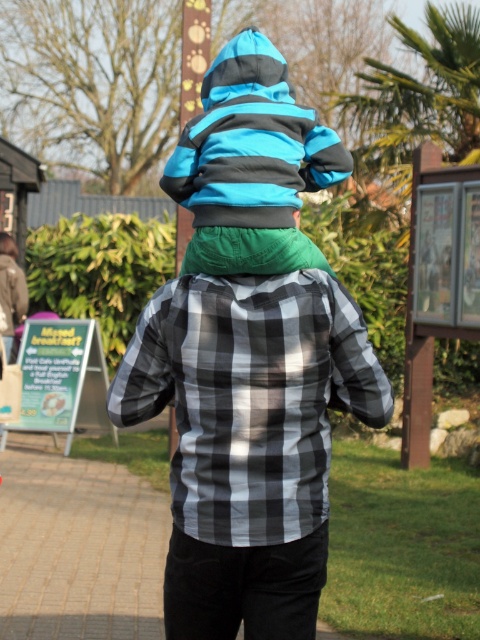
This screenshot has width=480, height=640. What do you see at coordinates (251, 397) in the screenshot? I see `checkered fabric shirt at center` at bounding box center [251, 397].

Is checkered fabric shirt at center to the right of blue striped jacket at center from the viewer's perspective?

No, checkered fabric shirt at center is not to the right of blue striped jacket at center.

What do you see at coordinates (251, 397) in the screenshot? This screenshot has height=640, width=480. I see `checkered fabric shirt at center` at bounding box center [251, 397].

The width and height of the screenshot is (480, 640). Find the location of `checkered fabric shirt at center`. checkered fabric shirt at center is located at coordinates (251, 397).

Between black checkered shirt at center and blue striped jacket at center, which one appears on the left side from the viewer's perspective?

blue striped jacket at center

Can you confirm if black checkered shirt at center is positioned above blue striped jacket at center?

Incorrect, black checkered shirt at center is not positioned above blue striped jacket at center.

What do you see at coordinates (402, 547) in the screenshot? I see `black checkered shirt at center` at bounding box center [402, 547].

Locate an element on the screen. This screenshot has width=480, height=640. black checkered shirt at center is located at coordinates (402, 547).

This screenshot has width=480, height=640. What do you see at coordinates (251, 397) in the screenshot?
I see `checkered fabric shirt at center` at bounding box center [251, 397].

Is checkered fabric shirt at center to the right of black checkered shirt at center from the viewer's perspective?

No, checkered fabric shirt at center is not to the right of black checkered shirt at center.

Is point (140, 339) closer to camera compared to point (375, 492)?

Yes.

Image resolution: width=480 pixels, height=640 pixels. Find the location of `checkered fabric shirt at center`. checkered fabric shirt at center is located at coordinates (251, 397).